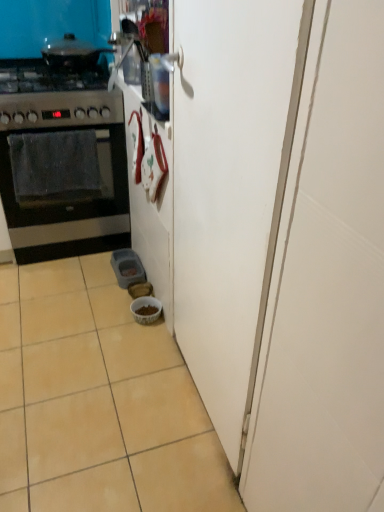
In order to click on vacant space situated on the left part of white matte door at center in this screenshot , I will do `click(106, 400)`.